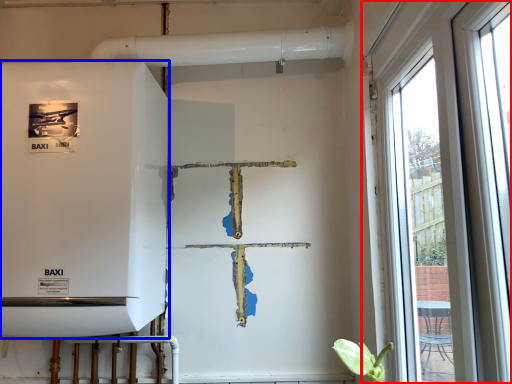
Question: Which point is further to the camera, window (highlighted by a red box) or appliance (highlighted by a blue box)?

Choices:
 (A) window
 (B) appliance

Answer: (B)